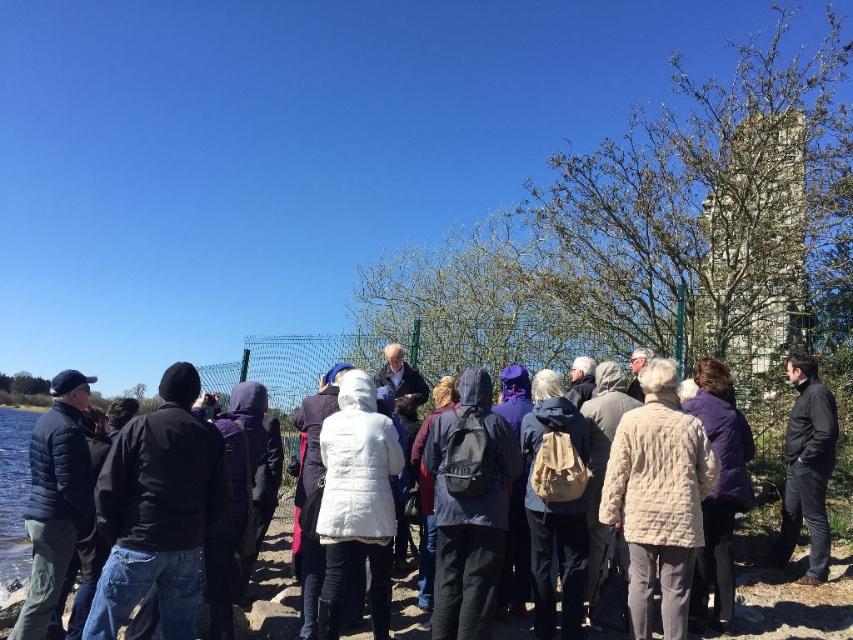
Question: From the image, what is the correct spatial relationship of white wool coat at center in relation to black matte jacket at lower right?

Choices:
 (A) above
 (B) below

Answer: (B)

Question: Which point is closer to the camera?

Choices:
 (A) white wool coat at center
 (B) black matte jacket at lower right

Answer: (A)

Question: Does white wool coat at center have a greater width compared to black matte jacket at lower right?

Choices:
 (A) no
 (B) yes

Answer: (B)

Question: Is white wool coat at center to the right of black matte jacket at lower right from the viewer's perspective?

Choices:
 (A) yes
 (B) no

Answer: (B)